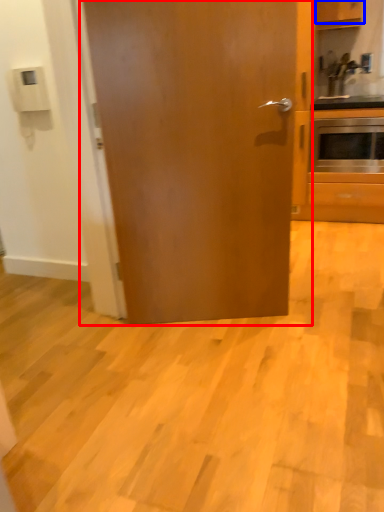
Question: Which of the following is the farthest to the observer, door (highlighted by a red box) or cabinetry (highlighted by a blue box)?

Choices:
 (A) door
 (B) cabinetry

Answer: (B)